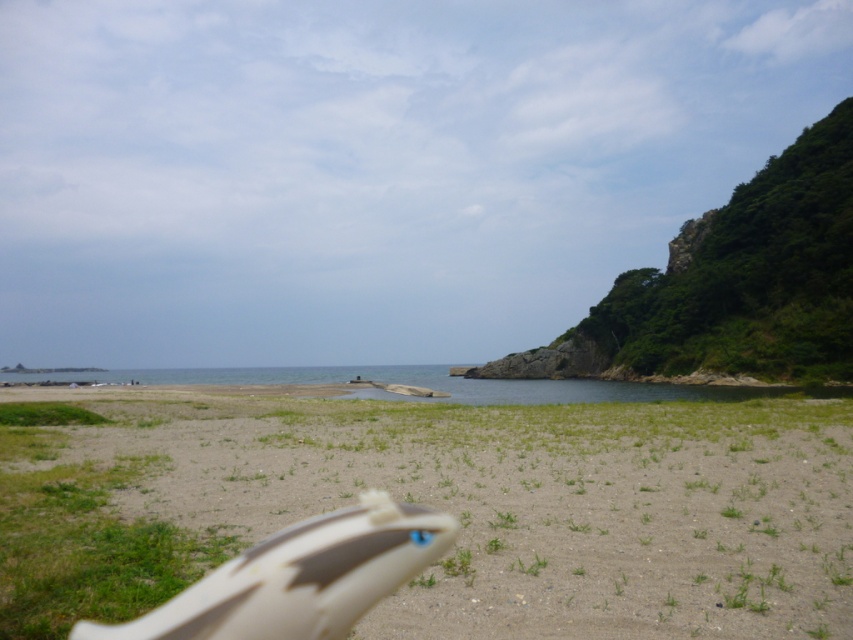
Does sandy beige at lower center appear over clear blue water at center?

Correct, sandy beige at lower center is located above clear blue water at center.

Does sandy beige at lower center appear under clear blue water at center?

No.

The image size is (853, 640). I want to click on sandy beige at lower center, so click(x=517, y=502).